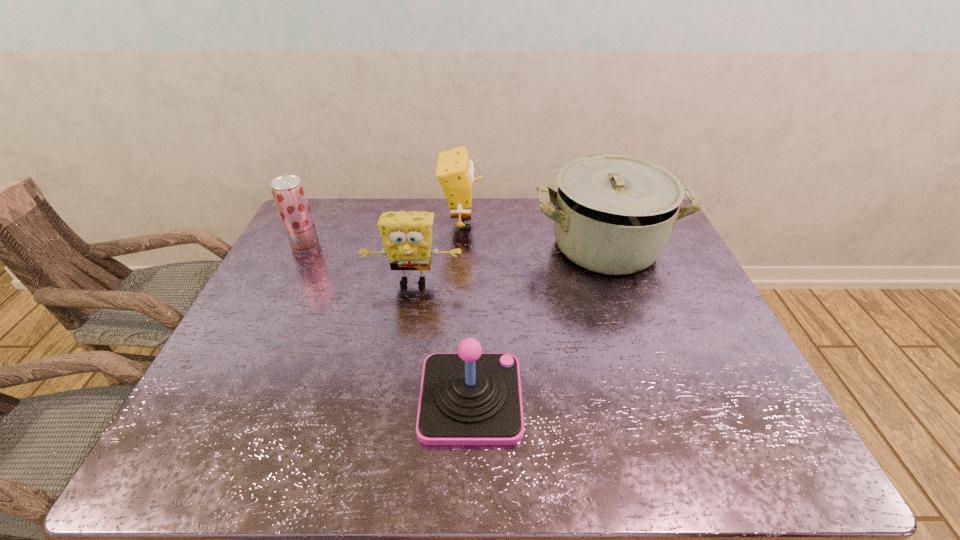
Locate which object ranks second in proximity to the farther sponge. Please provide its 2D coordinates. Your answer should be formatted as a tuple, i.e. [(x, y)], where the tuple contains the x and y coordinates of a point satisfying the conditions above.

[(407, 236)]

This screenshot has height=540, width=960. What are the coordinates of `vacant position in the image that satisfies the following two spatial constraints: 1. on the face of the rightmost object; 2. on the right side of the farther sponge` in the screenshot? It's located at (460, 246).

The width and height of the screenshot is (960, 540). I want to click on free space that satisfies the following two spatial constraints: 1. on the face of the farther sponge; 2. on the face of the nearer sponge, so (x=458, y=282).